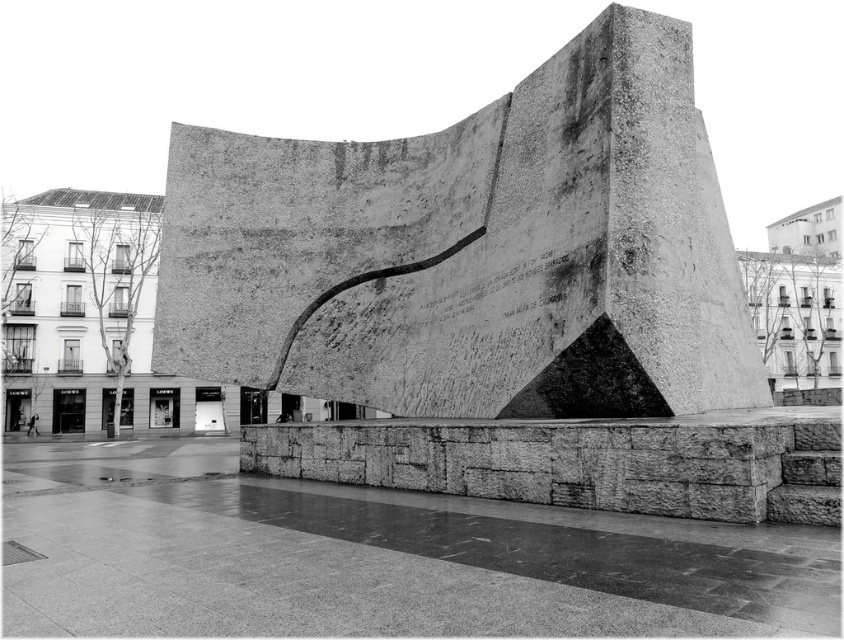
Question: From the image, what is the correct spatial relationship of rough concrete sculpture at center in relation to smooth concrete wall at lower center?

Choices:
 (A) right
 (B) left

Answer: (A)

Question: Is smooth concrete wall at lower center bigger than rough stone ledge at center?

Choices:
 (A) no
 (B) yes

Answer: (A)

Question: Which point is farther to the camera?

Choices:
 (A) rough concrete sculpture at center
 (B) rough stone ledge at center
 (C) smooth concrete wall at lower center

Answer: (A)

Question: Based on their relative distances, which object is farther from the rough concrete sculpture at center?

Choices:
 (A) rough stone ledge at center
 (B) smooth concrete wall at lower center

Answer: (B)

Question: Does rough concrete sculpture at center appear on the left side of smooth concrete wall at lower center?

Choices:
 (A) yes
 (B) no

Answer: (B)

Question: Which point is closer to the camera?

Choices:
 (A) rough stone ledge at center
 (B) rough concrete sculpture at center

Answer: (A)